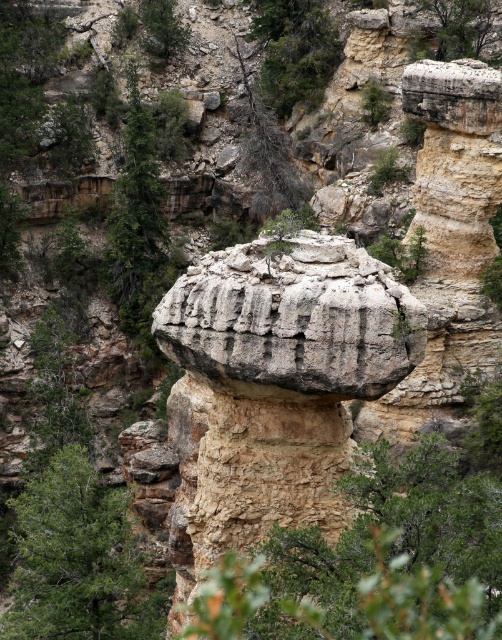
Question: Is green leafy tree at lower left bigger than green leafy tree at upper right?

Choices:
 (A) yes
 (B) no

Answer: (A)

Question: Is green leafy tree at lower left wider than green leafy tree at upper center?

Choices:
 (A) no
 (B) yes

Answer: (B)

Question: Among these points, which one is nearest to the camera?

Choices:
 (A) (293, 100)
 (B) (54, 483)

Answer: (B)

Question: Estimate the real-world distances between objects in this image. Which object is farther from the green textured rock at upper center?

Choices:
 (A) green rough tree at upper left
 (B) green leafy tree at upper center

Answer: (B)

Question: Which point appears closest to the camera in this image?

Choices:
 (A) (454, 8)
 (B) (159, 16)
 (C) (120, 499)
 (D) (329, 42)

Answer: (C)

Question: From the image, what is the correct spatial relationship of green rough tree at upper left in relation to green textured rock at upper center?

Choices:
 (A) left
 (B) right

Answer: (A)